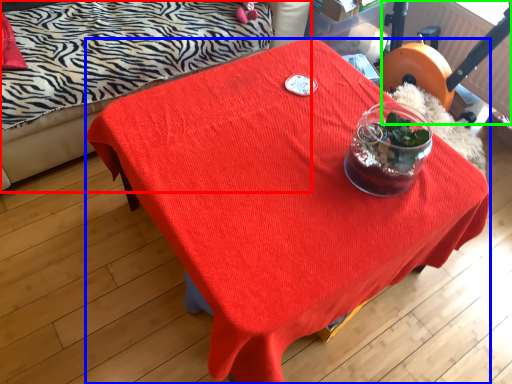
Question: Which is nearer to the studio couch (highlighted by a red box)? desk (highlighted by a blue box) or swivel chair (highlighted by a green box).

Choices:
 (A) desk
 (B) swivel chair

Answer: (A)